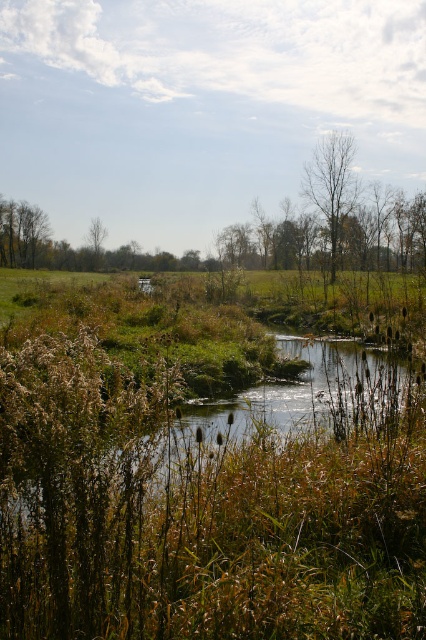
You are a bird looking for a place to perch. You see a bare wood tree at upper center and a green leafy tree at left. Which tree is located closer to the upper part of the scene?

The bare wood tree at upper center is positioned under the green leafy tree at left, so the green leafy tree at left is closer to the upper part of the scene.

You are an ornithologist observing birds in the serene natural landscape. You notice two trees, the bare wood tree at upper center and the green leafy tree at left. Which tree would likely provide a better nesting spot for a bird seeking height? Please base your answer on the trees

The bare wood tree at upper center is much taller than the green leafy tree at left, so it would provide a better nesting spot for a bird seeking height.